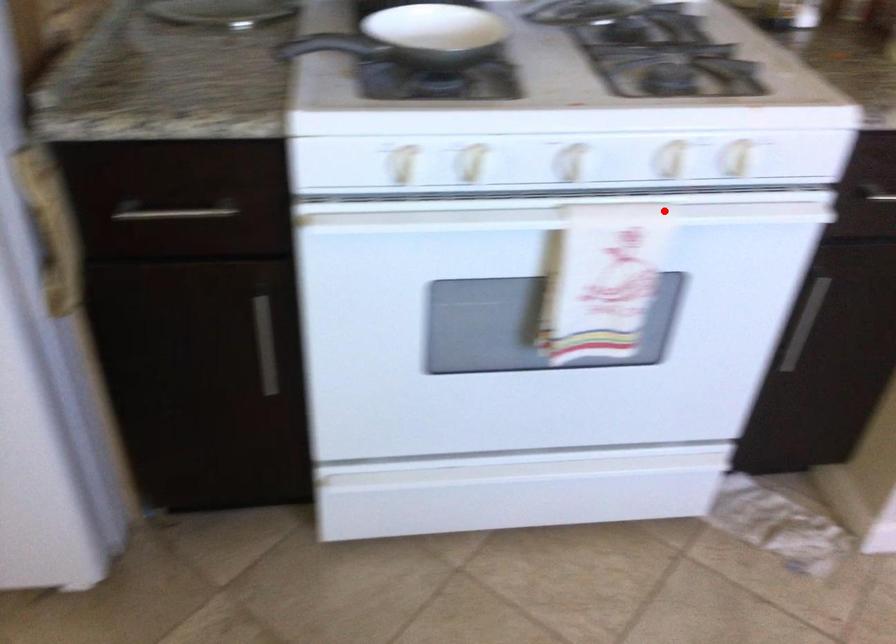
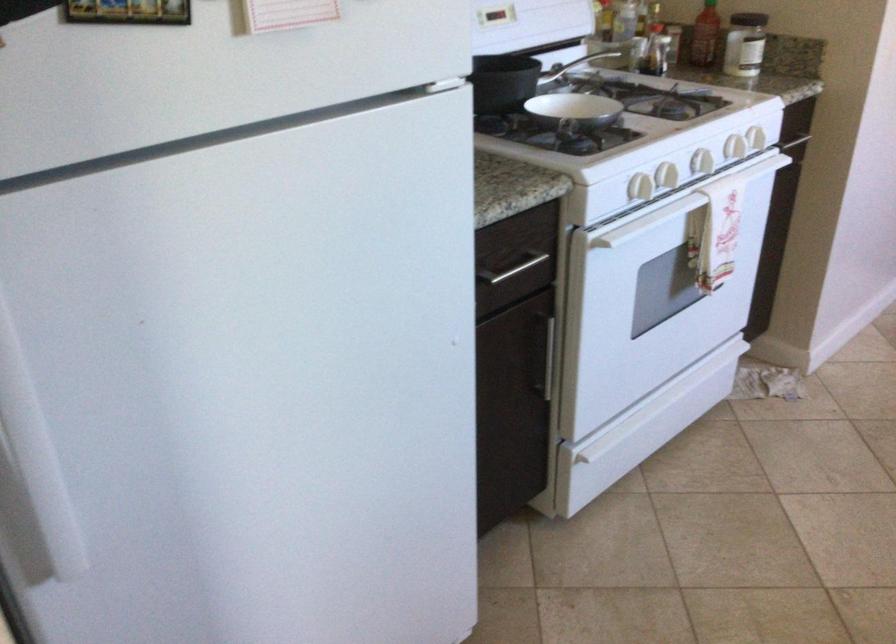
Question: I am providing you with two images of the same scene from different viewpoints. In image1, a red point is highlighted. Considering the same 3D point in image2, which of the following is correct?

Choices:
 (A) It is closer
 (B) It is farther

Answer: (B)